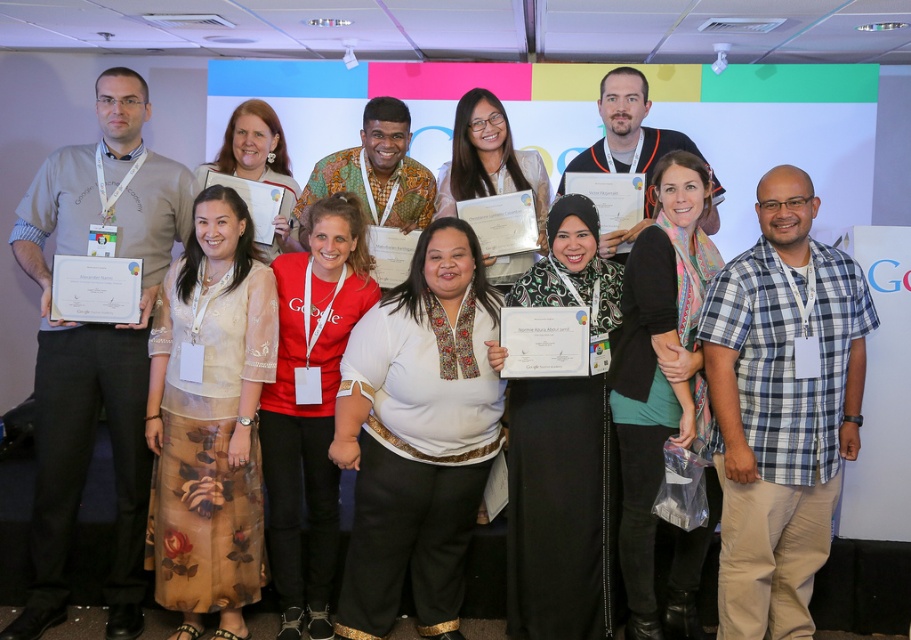
Question: Which point is closer to the camera taking this photo?

Choices:
 (A) (817, 328)
 (B) (661, 221)

Answer: (A)

Question: Can you confirm if black matte scarf at center is positioned below matte black shirt at center?

Choices:
 (A) no
 (B) yes

Answer: (B)

Question: Does blue plaid shirt at right come behind matte white blouse at center?

Choices:
 (A) yes
 (B) no

Answer: (B)

Question: Is blue plaid shirt at right further to camera compared to red matte shirt at center?

Choices:
 (A) yes
 (B) no

Answer: (B)

Question: Among these objects, which one is farthest from the camera?

Choices:
 (A) black matte scarf at center
 (B) matte gray sweater at left
 (C) matte white blouse at center

Answer: (C)

Question: Which object is farther from the camera taking this photo?

Choices:
 (A) matte black shirt at center
 (B) white embroidered blouse at center

Answer: (A)